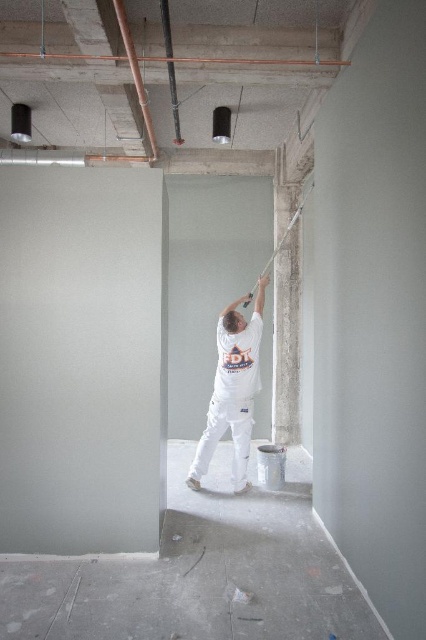
Question: Considering the real-world distances, which object is closest to the white matte/latex shirt at center?

Choices:
 (A) matte black pipe at upper center
 (B) copper pipe at upper left

Answer: (B)

Question: Observing the image, what is the correct spatial positioning of white matte/latex shirt at center in reference to matte black pipe at upper center?

Choices:
 (A) above
 (B) below

Answer: (B)

Question: Among these points, which one is nearest to the camera?

Choices:
 (A) (173, 90)
 (B) (249, 410)
 (C) (124, 20)

Answer: (C)

Question: Which point appears farthest from the camera in this image?

Choices:
 (A) (245, 417)
 (B) (144, 100)
 (C) (170, 72)

Answer: (A)

Question: Does white matte/latex shirt at center have a lesser width compared to matte black pipe at upper center?

Choices:
 (A) yes
 (B) no

Answer: (B)

Question: Where is copper pipe at upper left located in relation to matte black pipe at upper center in the image?

Choices:
 (A) left
 (B) right

Answer: (A)